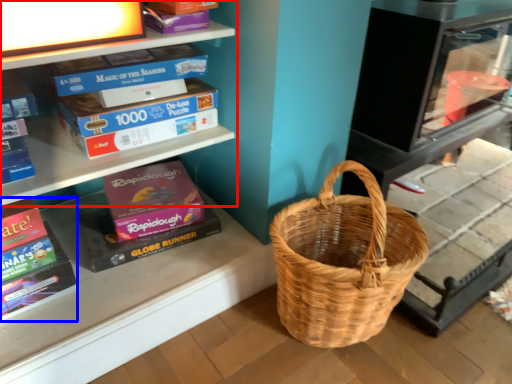
Question: Which of the following is the farthest to the observer, shelf (highlighted by a red box) or paperback book (highlighted by a blue box)?

Choices:
 (A) shelf
 (B) paperback book

Answer: (A)